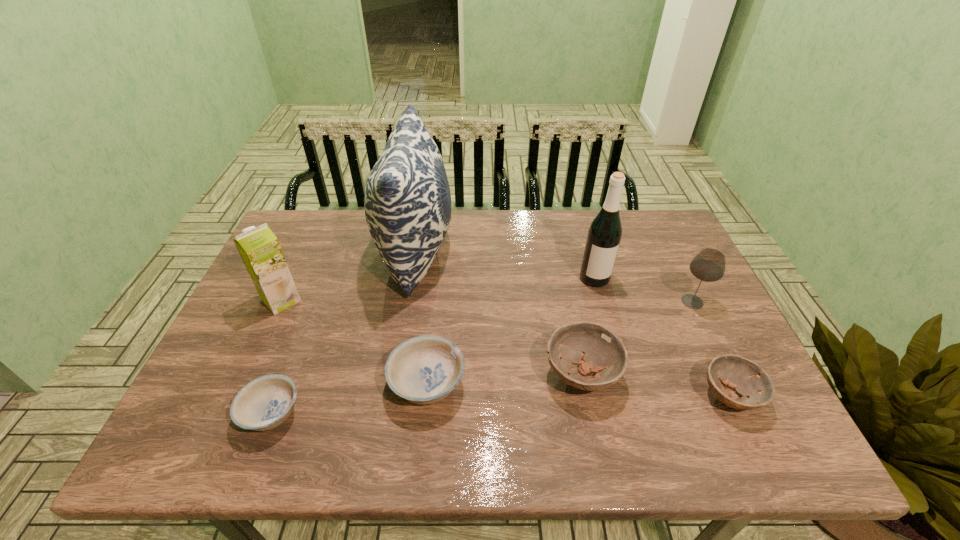
I want to click on vacant space located on the left of the smaller brown bowl, so click(541, 395).

What are the coordinates of `blank space located 0.220m on the right of the left blue bowl` in the screenshot? It's located at (402, 413).

Identify the location of object that is at the far edge. Image resolution: width=960 pixels, height=540 pixels. (407, 201).

You are a GUI agent. You are given a task and a screenshot of the screen. Output one action in this format:
    pyautogui.click(x=<x>, y=<y>)
    Task: Click on the soya milk present at the left edge
    The image size is (960, 540).
    Given the screenshot: What is the action you would take?
    pyautogui.click(x=259, y=248)

This screenshot has width=960, height=540. In order to click on bowl situated at the left edge in this screenshot , I will do `click(264, 403)`.

This screenshot has width=960, height=540. In order to click on wineglass present at the right edge in this screenshot , I will do `click(708, 265)`.

This screenshot has width=960, height=540. What are the coordinates of `bowl at the right edge` in the screenshot? It's located at tap(747, 378).

Identify the location of object present at the near left corner. The image size is (960, 540). (264, 403).

Where is `object that is at the near right corner`? The image size is (960, 540). object that is at the near right corner is located at coordinates (747, 378).

At what (x,y) coordinates should I click in order to perform the action: click on free space at the far edge of the desktop. Please return your answer as a coordinate pair (x, y). Looking at the image, I should click on (534, 237).